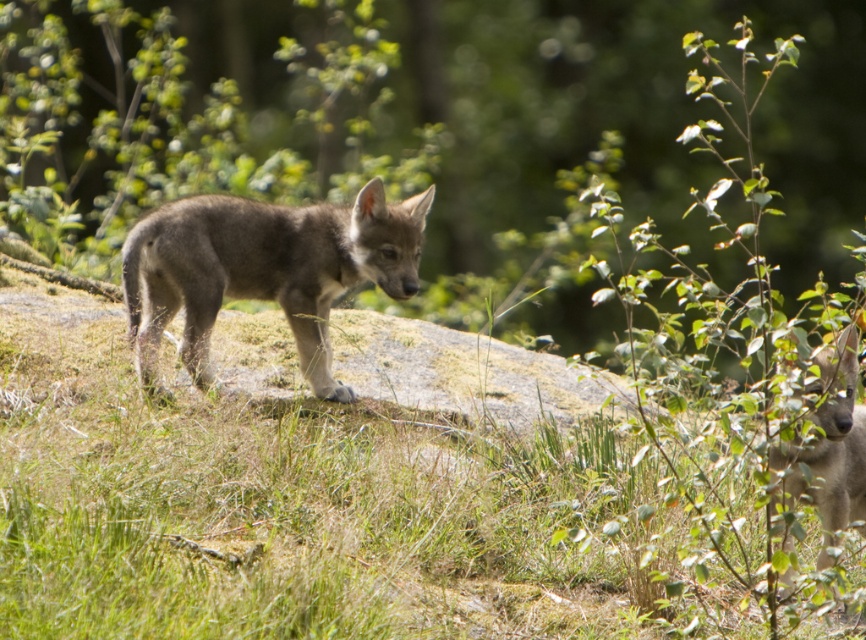
You are a photographer trying to capture the gray fur wolf pup at center. You notice the green grassy at center might be distracting. Which direction should you move your camera to focus solely on the wolf pup?

The green grassy at center is to the right of the gray fur wolf pup at center, so you should move your camera slightly to the left to eliminate the green grassy at center from the frame and focus on the wolf pup.

You are a photographer trying to capture the gray fur dog at right and the green grassy at center in a single frame. Based on their sizes, which one should you focus on to ensure both are clearly visible?

The green grassy at center has a larger size compared to gray fur dog at right, so focusing on the green grassy at center will help ensure both are clearly visible in the frame.